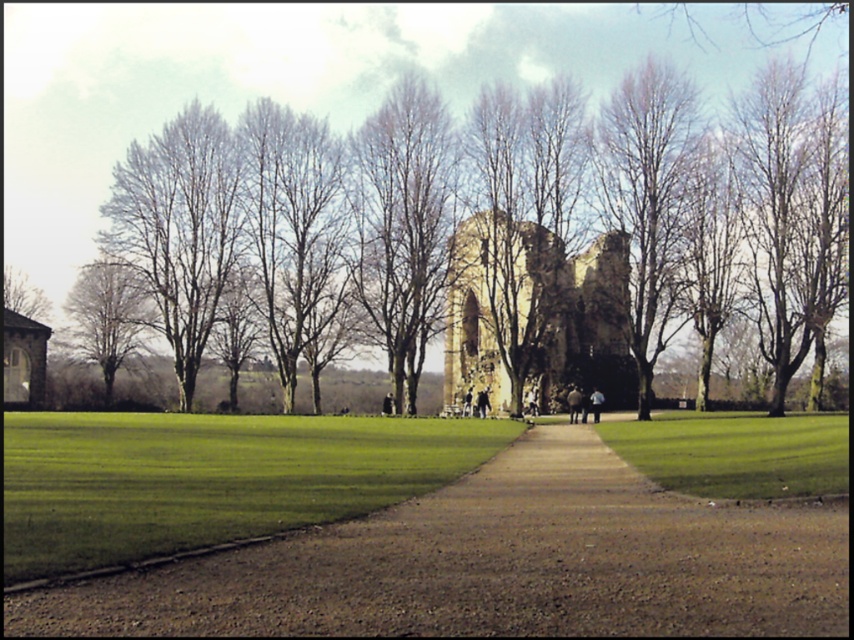
You are standing at the entrance of the historical ruin and want to take a photo of the brown textured tree at center. Where should you position yourself to capture the tree in the frame?

The brown textured tree at center is located at point 0.316 on the x axis and 0.760 on the y axis, so you should position yourself in the lower left area to capture it in the frame.